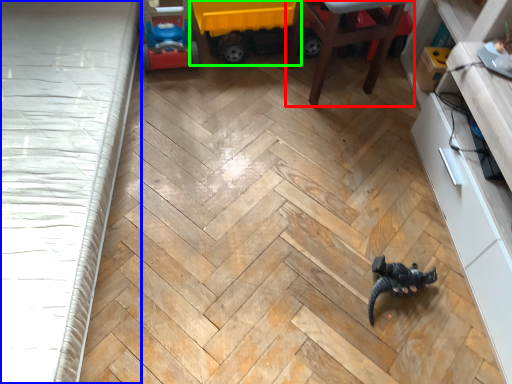
Question: Which is nearer to the furniture (highlighted by a red box)? bed frame (highlighted by a blue box) or toy (highlighted by a green box).

Choices:
 (A) bed frame
 (B) toy

Answer: (B)